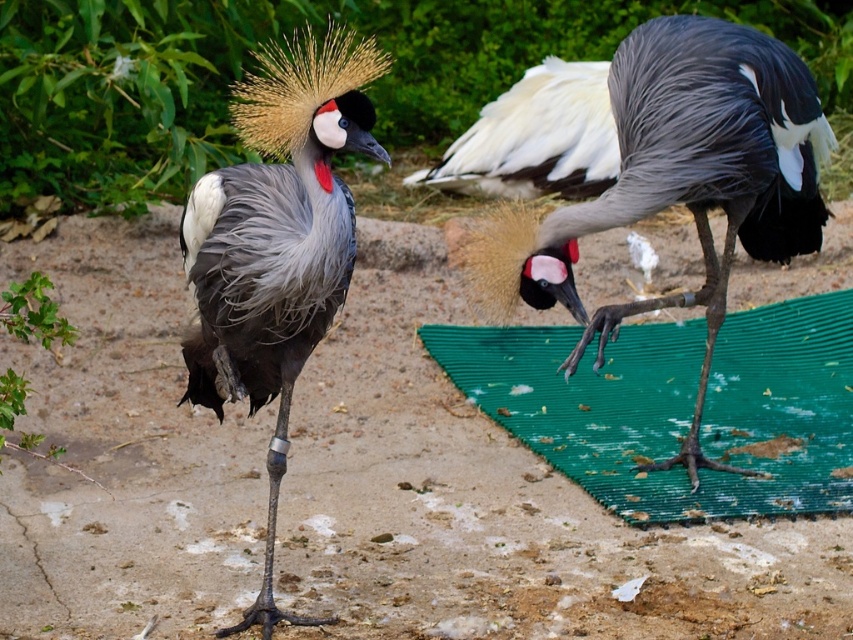
Question: Does gray matte bird at center have a larger size compared to white glossy feathers at center?

Choices:
 (A) no
 (B) yes

Answer: (B)

Question: Considering the real-world distances, which object is closest to the gray matte bird at center?

Choices:
 (A) white glossy feathers at center
 (B) matte gray bird at center
 (C) green rubber mat at lower right

Answer: (C)

Question: Among these objects, which one is nearest to the camera?

Choices:
 (A) matte gray bird at center
 (B) white glossy feathers at center

Answer: (A)

Question: Is green rubber mat at lower right to the left of matte gray bird at center from the viewer's perspective?

Choices:
 (A) yes
 (B) no

Answer: (B)

Question: Which object appears farthest from the camera in this image?

Choices:
 (A) matte gray bird at center
 (B) white glossy feathers at center
 (C) green rubber mat at lower right
 (D) gray matte bird at center

Answer: (B)

Question: Does green rubber mat at lower right have a lesser width compared to matte gray bird at center?

Choices:
 (A) no
 (B) yes

Answer: (A)